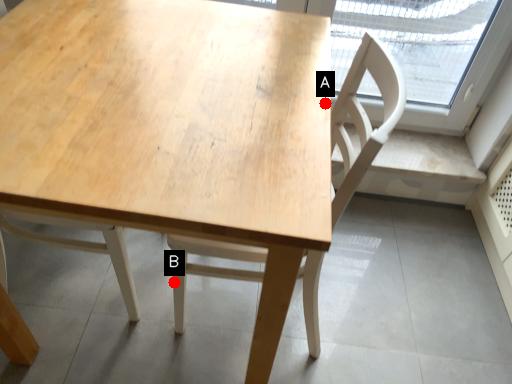
Question: Two points are circled on the image, labeled by A and B beside each circle. Which point is further to the camera?

Choices:
 (A) A is further
 (B) B is further

Answer: (B)